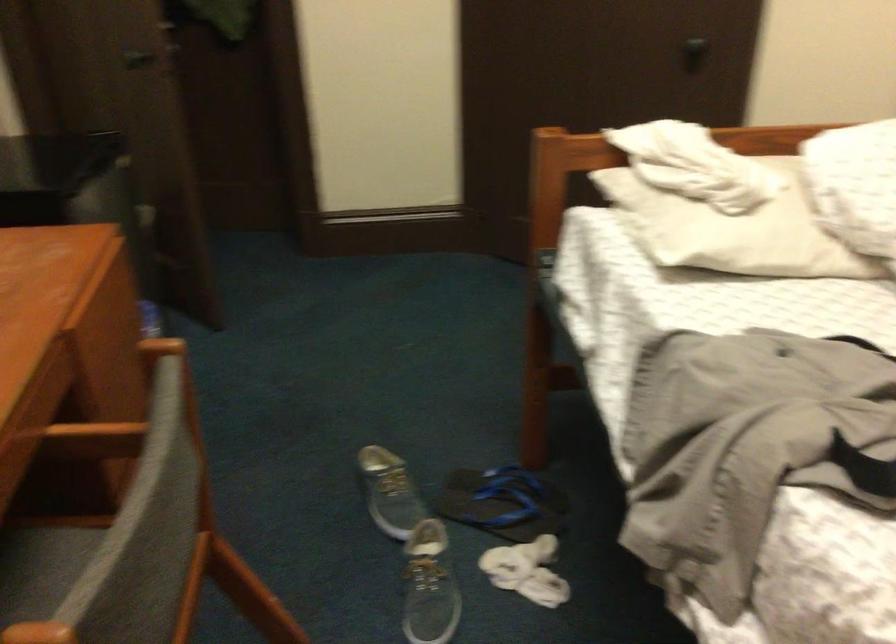
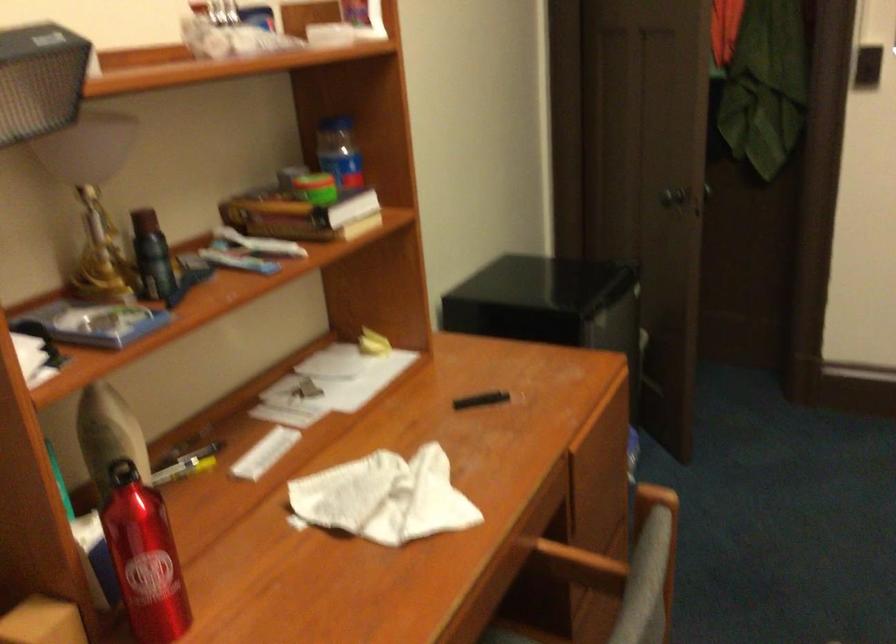
Where in the second image is the point corresponding to (x=100, y=444) from the first image?

(579, 565)